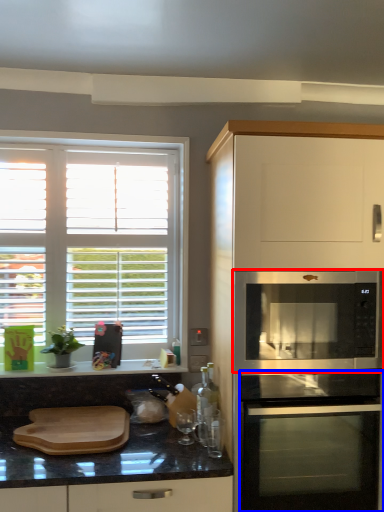
Question: Which object is closer to the camera taking this photo, microwave oven (highlighted by a red box) or oven (highlighted by a blue box)?

Choices:
 (A) microwave oven
 (B) oven

Answer: (B)